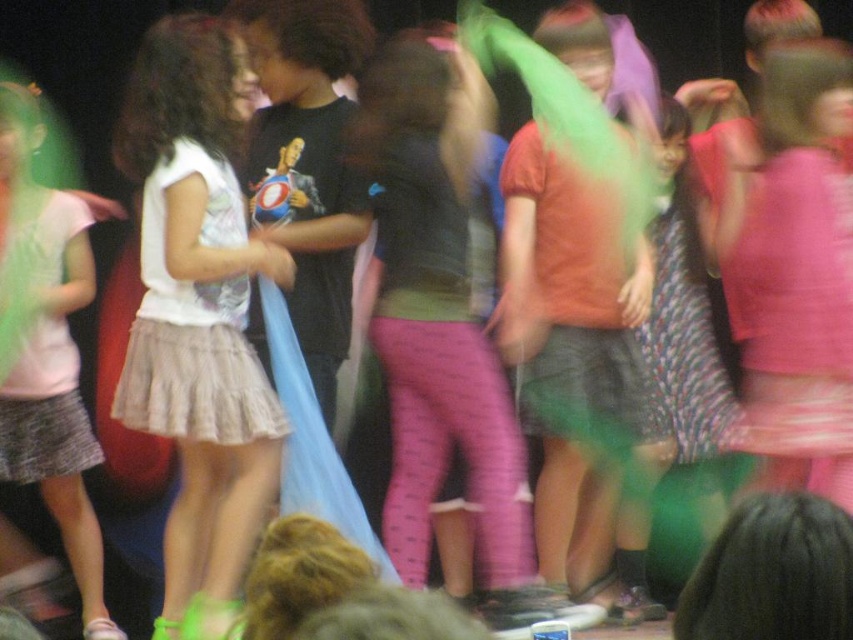
You are a photographer trying to focus on the white matte skirt at left in the image. What are the coordinates where you should aim your camera to capture it accurately?

The white matte skirt at left is located at coordinates point (198, 314), so aim your camera there to capture it accurately.

You are a photographer who just took a photo of children at a party. In the image, you notice two objects labeled as white matte skirt at left and matte white skirt at left. Which one is shorter?

The white matte skirt at left is shorter than the matte white skirt at left.